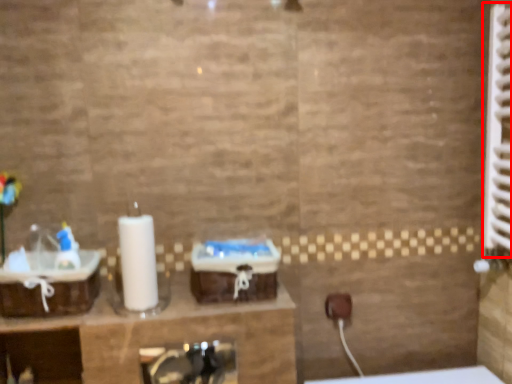
Question: Observing the image, what is the correct spatial positioning of radiator (annotated by the red box) in reference to sink?

Choices:
 (A) left
 (B) right

Answer: (B)